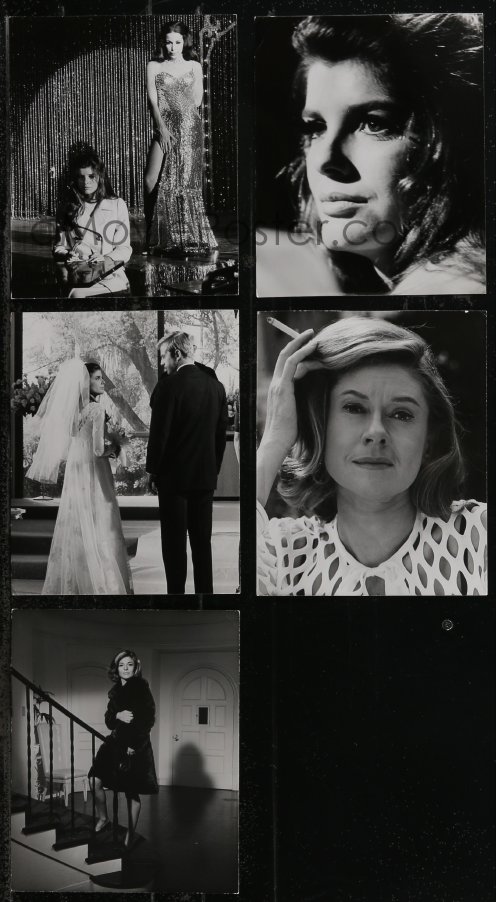
Identify the location of floor. (175, 840).